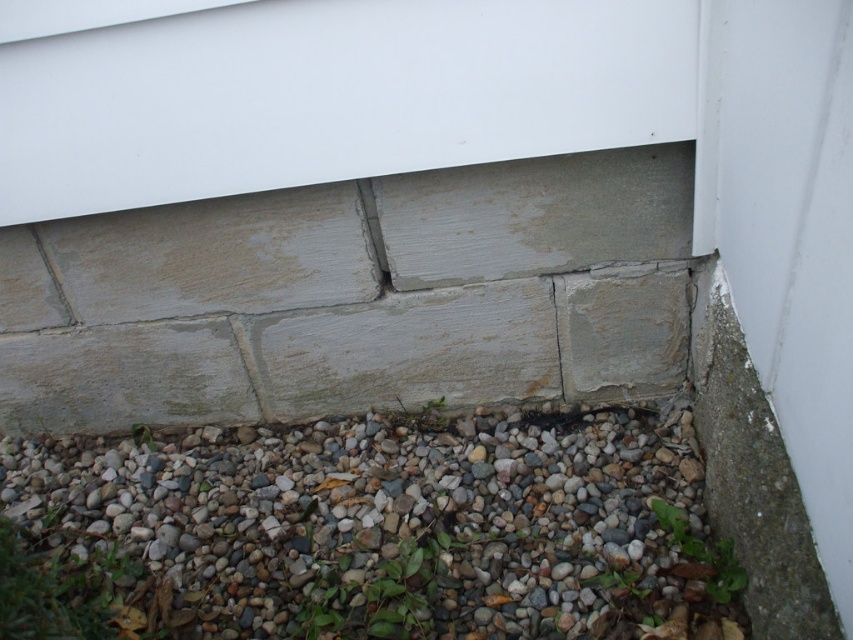
You are a construction inspector examining the foundation area. You notice the gray gravel at lower center and the gray concrete crack at lower left. From your vantage point, which object is closer to you?

The gray gravel at lower center is closer to you because it is in front of the gray concrete crack at lower left.

You are a construction inspector examining the foundation area. You notice the gray gravel at lower center and the gray concrete crack at lower left. From your vantage point, which object is positioned to the right side?

The gray gravel at lower center is positioned to the right of the gray concrete crack at lower left.